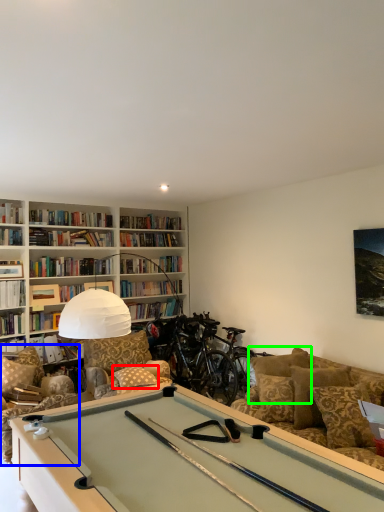
Question: Considering the real-world distances, which object is farthest from pillow (highlighted by a red box)? swivel chair (highlighted by a blue box) or pillow (highlighted by a green box)?

Choices:
 (A) swivel chair
 (B) pillow

Answer: (B)